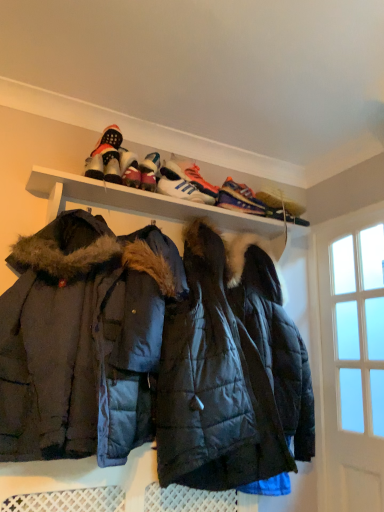
Describe the element at coordinates (282, 208) in the screenshot. I see `shiny black sneakers at upper center, marked as the 1th footwear in a right-to-left arrangement` at that location.

Where is `clear glass door at right`? clear glass door at right is located at coordinates (359, 328).

Where is `white leather sneakers at upper center, the 2th footwear viewed from the left`? The height and width of the screenshot is (512, 384). white leather sneakers at upper center, the 2th footwear viewed from the left is located at coordinates (129, 168).

Measure the distance between white leather sneakers at upper center, the 2th footwear viewed from the left, and camera.

A distance of 1.84 meters exists between white leather sneakers at upper center, the 2th footwear viewed from the left, and camera.

This screenshot has width=384, height=512. What do you see at coordinates (239, 198) in the screenshot?
I see `blue suede sneaker at upper center, the fourth footwear in the left-to-right sequence` at bounding box center [239, 198].

Measure the distance between point (116, 170) and camera.

Point (116, 170) is 6.00 feet away from camera.

In order to click on shiny black sneakers at upper center, the fifth footwear when ordered from left to right in this screenshot , I will do `click(282, 208)`.

Between white matte shelf at upper center and white leather sneakers at upper center, the 2th footwear viewed from the left, which one is positioned behind?

white leather sneakers at upper center, the 2th footwear viewed from the left, is further away from the camera.

Is white matte shelf at upper center not inside white leather sneakers at upper center, the 2th footwear viewed from the left?

Yes, white matte shelf at upper center is not within white leather sneakers at upper center, the 2th footwear viewed from the left.

Measure the distance from white matte shelf at upper center to blue suede sneaker at upper center, the second footwear from the right.

The distance of white matte shelf at upper center from blue suede sneaker at upper center, the second footwear from the right, is 9.68 inches.

Is white matte shelf at upper center next to blue suede sneaker at upper center, the fourth footwear in the left-to-right sequence?

No, white matte shelf at upper center is not beside blue suede sneaker at upper center, the fourth footwear in the left-to-right sequence.

From a real-world perspective, is white matte shelf at upper center physically above blue suede sneaker at upper center, the second footwear from the right?

No.

Is white matte shelf at upper center aimed at blue suede sneaker at upper center, the second footwear from the right?

No, white matte shelf at upper center is not facing towards blue suede sneaker at upper center, the second footwear from the right.

Is point (350, 364) more distant than point (267, 219)?

That is True.

Can you tell me how much clear glass door at right and white matte shelf at upper center differ in facing direction?

The angular difference between clear glass door at right and white matte shelf at upper center is 90 degrees.

From a real-world perspective, is clear glass door at right located beneath white matte shelf at upper center?

Indeed, from a real-world perspective, clear glass door at right is positioned beneath white matte shelf at upper center.

Is white leather sneakers at upper center, the 3th footwear when ordered from left to right, positioned with its back to white matte shelf at upper center?

No.

Is white leather sneakers at upper center, the third footwear positioned from the right, placed right next to white matte shelf at upper center?

No, white leather sneakers at upper center, the third footwear positioned from the right, is not beside white matte shelf at upper center.

Considering the positions of objects white leather sneakers at upper center, the third footwear positioned from the right, and white matte shelf at upper center in the image provided, who is more to the right, white leather sneakers at upper center, the third footwear positioned from the right, or white matte shelf at upper center?

white leather sneakers at upper center, the third footwear positioned from the right.

Is white leather sneakers at upper center, the third footwear positioned from the right, taller or shorter than white matte shelf at upper center?

In the image, white leather sneakers at upper center, the third footwear positioned from the right, appears to be shorter than white matte shelf at upper center.

Could you tell me if white leather sneakers at upper center, the 2th footwear viewed from the left, is turned towards white leather sneakers at upper center, the 3th footwear when ordered from left to right?

No, white leather sneakers at upper center, the 2th footwear viewed from the left, is not turned towards white leather sneakers at upper center, the 3th footwear when ordered from left to right.

Considering the sizes of white leather sneakers at upper center, the 2th footwear viewed from the left, and white leather sneakers at upper center, the third footwear positioned from the right, in the image, is white leather sneakers at upper center, the 2th footwear viewed from the left, wider or thinner than white leather sneakers at upper center, the third footwear positioned from the right,?

Clearly, white leather sneakers at upper center, the 2th footwear viewed from the left, has more width compared to white leather sneakers at upper center, the third footwear positioned from the right.

Does white leather sneakers at upper center, arranged as the fourth footwear when viewed from the right, have a larger size compared to white leather sneakers at upper center, the 3th footwear when ordered from left to right?

No.

In the scene shown: From the image's perspective, would you say white leather sneakers at upper center, the third footwear positioned from the right, is positioned over white leather sneakers at upper center, the 2th footwear viewed from the left?

Incorrect, from the image's perspective, white leather sneakers at upper center, the third footwear positioned from the right, is lower than white leather sneakers at upper center, the 2th footwear viewed from the left.

Is white leather sneakers at upper center, the 3th footwear when ordered from left to right, at the right side of white leather sneakers at upper center, arranged as the fourth footwear when viewed from the right?

Yes, white leather sneakers at upper center, the 3th footwear when ordered from left to right, is to the right of white leather sneakers at upper center, arranged as the fourth footwear when viewed from the right.

Which point is more distant from viewer, (169, 174) or (130, 162)?

The point (169, 174) is behind.

In terms of width, does white leather sneakers at upper center, the 3th footwear when ordered from left to right, look wider or thinner when compared to white leather sneakers at upper center, the 2th footwear viewed from the left?

white leather sneakers at upper center, the 3th footwear when ordered from left to right, is thinner than white leather sneakers at upper center, the 2th footwear viewed from the left.

You are a GUI agent. You are given a task and a screenshot of the screen. Output one action in this format:
    pyautogui.click(x=<x>, y=<y>)
    Task: Click on the footwear that is the 2nd one when counting rightward from the white matte shelf at upper center
    The width and height of the screenshot is (384, 512).
    Given the screenshot: What is the action you would take?
    pyautogui.click(x=239, y=198)

From their relative heights in the image, would you say blue suede sneaker at upper center, the fourth footwear in the left-to-right sequence, is taller or shorter than white matte shelf at upper center?

In the image, blue suede sneaker at upper center, the fourth footwear in the left-to-right sequence, appears to be shorter than white matte shelf at upper center.

Measure the distance between blue suede sneaker at upper center, the fourth footwear in the left-to-right sequence, and white matte shelf at upper center.

A distance of 9.68 inches exists between blue suede sneaker at upper center, the fourth footwear in the left-to-right sequence, and white matte shelf at upper center.

You are a GUI agent. You are given a task and a screenshot of the screen. Output one action in this format:
    pyautogui.click(x=<x>, y=<y>)
    Task: Click on the footwear that is the 2nd object located behind the white matte shelf at upper center
    The image size is (384, 512).
    Given the screenshot: What is the action you would take?
    pyautogui.click(x=129, y=168)

The height and width of the screenshot is (512, 384). I want to click on shelf that is on the left side of blue suede sneaker at upper center, the fourth footwear in the left-to-right sequence, so click(141, 203).

Looking at the image, which one is located closer to white matte shelf at upper center, white leather sneakers at upper center, arranged as the fourth footwear when viewed from the right, or clear glass door at right?

white leather sneakers at upper center, arranged as the fourth footwear when viewed from the right, is positioned closer to the anchor white matte shelf at upper center.

When comparing their distances from shiny black sneakers at upper center, marked as the 1th footwear in a right-to-left arrangement, does dark blue quilted jacket at center or blue suede sneaker at upper center, the fourth footwear in the left-to-right sequence, seem closer?

blue suede sneaker at upper center, the fourth footwear in the left-to-right sequence, lies closer to shiny black sneakers at upper center, marked as the 1th footwear in a right-to-left arrangement, than the other object.

Estimate the real-world distances between objects in this image. Which object is closer to blue suede sneaker at upper center, the second footwear from the right, dark blue quilted jacket at center or white leather sneakers at upper center, the 2th footwear viewed from the left?

The object closer to blue suede sneaker at upper center, the second footwear from the right, is white leather sneakers at upper center, the 2th footwear viewed from the left.

Estimate the real-world distances between objects in this image. Which object is further from shiny black sneakers at upper center, marked as the 1th footwear in a right-to-left arrangement, clear glass door at right or dark blue quilted jacket at center?

dark blue quilted jacket at center is positioned further to the anchor shiny black sneakers at upper center, marked as the 1th footwear in a right-to-left arrangement.

Which object lies further to the anchor point dark blue quilted jacket at center, blue suede sneaker at upper center, the fourth footwear in the left-to-right sequence, or white leather sneakers at upper center, the 3th footwear when ordered from left to right?

blue suede sneaker at upper center, the fourth footwear in the left-to-right sequence, lies further to dark blue quilted jacket at center than the other object.

When comparing their distances from shiny black sneakers at upper center, the fifth footwear when ordered from left to right, does white leather sneaker at upper center, the 5th footwear viewed from the right, or blue suede sneaker at upper center, the fourth footwear in the left-to-right sequence, seem closer?

blue suede sneaker at upper center, the fourth footwear in the left-to-right sequence, is positioned closer to the anchor shiny black sneakers at upper center, the fifth footwear when ordered from left to right.

Looking at the image, which one is located closer to white leather sneakers at upper center, the 3th footwear when ordered from left to right, white leather sneakers at upper center, the 2th footwear viewed from the left, or blue suede sneaker at upper center, the second footwear from the right?

blue suede sneaker at upper center, the second footwear from the right, is closer to white leather sneakers at upper center, the 3th footwear when ordered from left to right.

Which object lies nearer to the anchor point dark blue quilted jacket at center, shiny black sneakers at upper center, marked as the 1th footwear in a right-to-left arrangement, or blue suede sneaker at upper center, the second footwear from the right?

blue suede sneaker at upper center, the second footwear from the right.

This screenshot has height=512, width=384. In order to click on shelf located between white leather sneakers at upper center, arranged as the fourth footwear when viewed from the right, and clear glass door at right in the left-right direction in this screenshot , I will do `click(141, 203)`.

Locate an element on the screen. footwear located between white leather sneakers at upper center, the 2th footwear viewed from the left, and blue suede sneaker at upper center, the fourth footwear in the left-to-right sequence, in the left-right direction is located at coordinates (185, 183).

You are a GUI agent. You are given a task and a screenshot of the screen. Output one action in this format:
    pyautogui.click(x=<x>, y=<y>)
    Task: Click on the shelf located between dark blue quilted jacket at center and blue suede sneaker at upper center, the fourth footwear in the left-to-right sequence, in the depth direction
    
    Given the screenshot: What is the action you would take?
    pyautogui.click(x=141, y=203)

Locate an element on the screen. This screenshot has width=384, height=512. shelf between white leather sneakers at upper center, the 2th footwear viewed from the left, and white leather sneakers at upper center, the 3th footwear when ordered from left to right, from left to right is located at coordinates (141, 203).